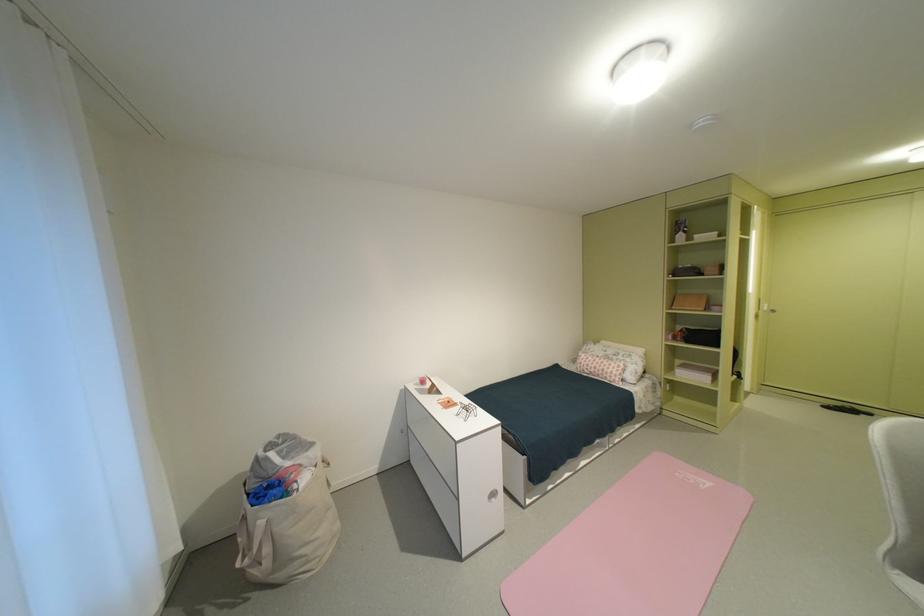
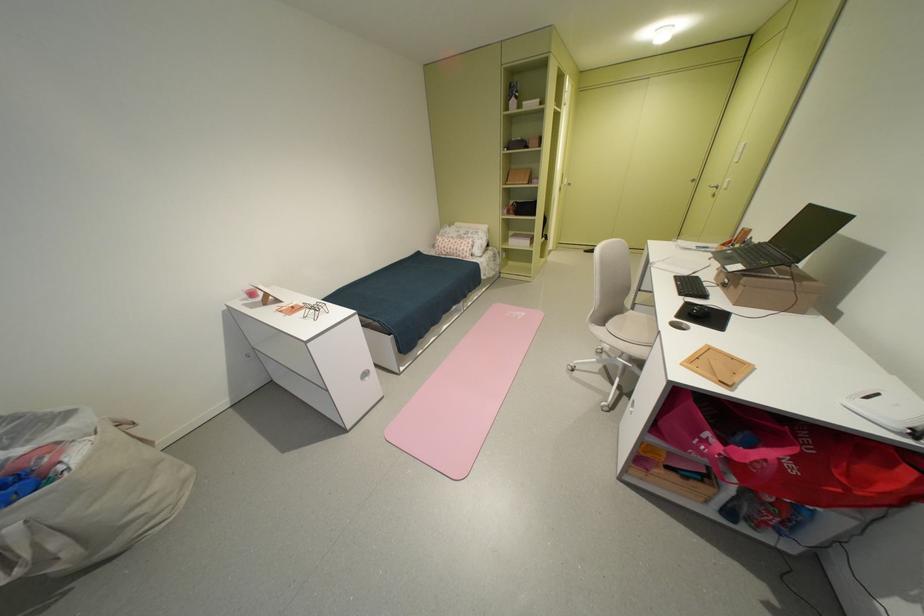
Where in the second image is the point corresponding to the point at 286,467 from the first image?

(6, 463)